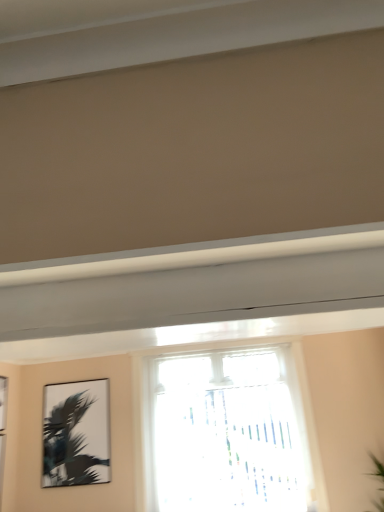
Question: Does transparent glass window at center have a lesser width compared to silvery metallic palm tree at upper left?

Choices:
 (A) yes
 (B) no

Answer: (B)

Question: Is transparent glass window at center not close to silvery metallic palm tree at upper left?

Choices:
 (A) no
 (B) yes

Answer: (B)

Question: Does transparent glass window at center appear on the left side of silvery metallic palm tree at upper left?

Choices:
 (A) no
 (B) yes

Answer: (A)

Question: Is transparent glass window at center oriented towards silvery metallic palm tree at upper left?

Choices:
 (A) no
 (B) yes

Answer: (A)

Question: Would you say transparent glass window at center is outside silvery metallic palm tree at upper left?

Choices:
 (A) yes
 (B) no

Answer: (A)

Question: Is transparent glass window at center further to camera compared to silvery metallic palm tree at upper left?

Choices:
 (A) yes
 (B) no

Answer: (B)

Question: From the image's perspective, would you say silvery metallic palm tree at upper left is shown under transparent glass window at center?

Choices:
 (A) yes
 (B) no

Answer: (A)

Question: Can we say silvery metallic palm tree at upper left lies outside transparent glass window at center?

Choices:
 (A) no
 (B) yes

Answer: (B)

Question: Considering the relative sizes of silvery metallic palm tree at upper left and transparent glass window at center in the image provided, is silvery metallic palm tree at upper left smaller than transparent glass window at center?

Choices:
 (A) no
 (B) yes

Answer: (B)

Question: Does silvery metallic palm tree at upper left have a greater width compared to transparent glass window at center?

Choices:
 (A) no
 (B) yes

Answer: (A)

Question: Is silvery metallic palm tree at upper left thinner than transparent glass window at center?

Choices:
 (A) no
 (B) yes

Answer: (B)

Question: Is silvery metallic palm tree at upper left bigger than transparent glass window at center?

Choices:
 (A) yes
 (B) no

Answer: (B)

Question: Is point (79, 480) positioned closer to the camera than point (150, 418)?

Choices:
 (A) closer
 (B) farther

Answer: (A)